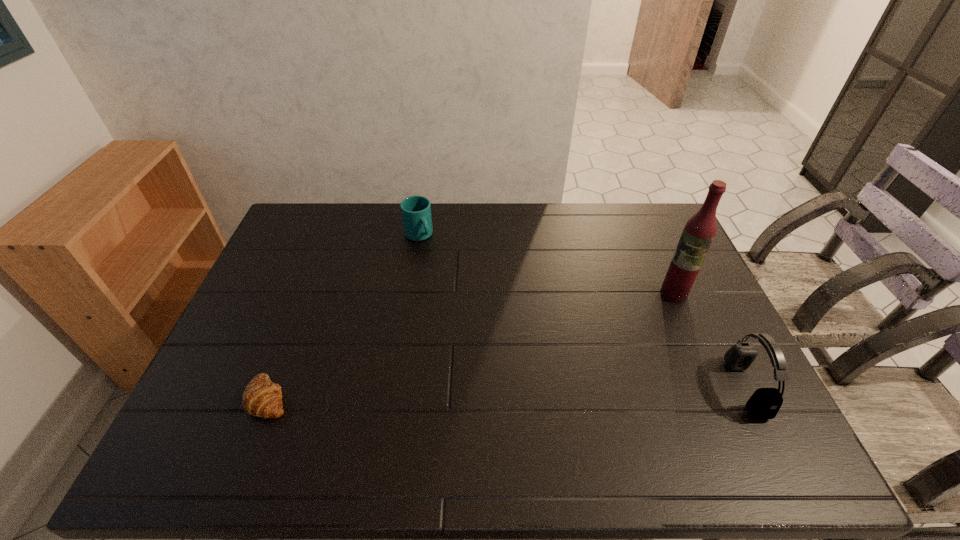
Where is `free region located 0.190m on the headband of the rightmost object`? This screenshot has height=540, width=960. free region located 0.190m on the headband of the rightmost object is located at coordinates (660, 388).

The width and height of the screenshot is (960, 540). In order to click on vacant space located on the headband of the rightmost object in this screenshot , I will do `click(647, 388)`.

The width and height of the screenshot is (960, 540). In order to click on vacant region located on the handle side of the cup in this screenshot , I will do `click(431, 253)`.

This screenshot has height=540, width=960. What are the coordinates of `free location located 0.120m on the handle side of the cup` in the screenshot? It's located at (440, 265).

Find the location of a particular element. This screenshot has width=960, height=540. vacant space located 0.110m on the handle side of the cup is located at coordinates (439, 264).

Image resolution: width=960 pixels, height=540 pixels. In order to click on free location located 0.190m on the label of the third object from left to right in this screenshot , I will do `click(630, 333)`.

This screenshot has width=960, height=540. Find the location of `vacant space located 0.340m on the label of the third object from left to right`. vacant space located 0.340m on the label of the third object from left to right is located at coordinates (596, 362).

Locate an element on the screen. This screenshot has width=960, height=540. vacant space located on the label of the third object from left to right is located at coordinates (628, 335).

The width and height of the screenshot is (960, 540). Find the location of `object that is at the far edge`. object that is at the far edge is located at coordinates (416, 210).

At what (x,y) coordinates should I click in order to perform the action: click on crescent roll positioned at the near edge. Please return your answer as a coordinate pair (x, y). Looking at the image, I should click on (262, 398).